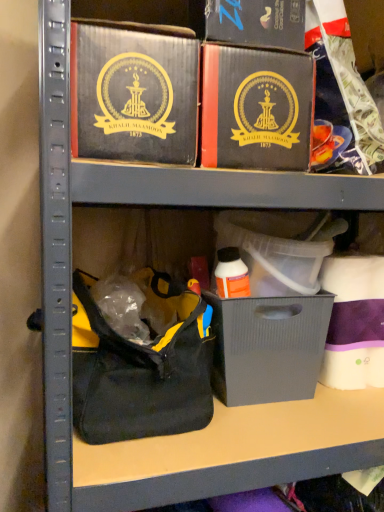
Image resolution: width=384 pixels, height=512 pixels. I want to click on black fabric handbag at lower left, so click(x=141, y=367).

Where is `matte black box at center, marked as the 2th box in a left-to-right arrangement`? matte black box at center, marked as the 2th box in a left-to-right arrangement is located at coordinates (256, 108).

Locate an element on the screen. matte gray plastic bin at center is located at coordinates (268, 347).

You are a GUI agent. You are given a task and a screenshot of the screen. Output one action in this format:
    pyautogui.click(x=<x>, y=<y>)
    Task: Click on the black fabric handbag at lower left
    This screenshot has height=512, width=384.
    Given the screenshot: What is the action you would take?
    pyautogui.click(x=141, y=367)

Is matte black box at upper center positioned with its back to matte black box at upper center, which is counted as the 1th box, starting from the left?

No, matte black box at upper center is not facing away from matte black box at upper center, which is counted as the 1th box, starting from the left.

Considering the sizes of objects matte black box at upper center and matte black box at upper center, the second box in the right-to-left sequence, in the image provided, who is bigger, matte black box at upper center or matte black box at upper center, the second box in the right-to-left sequence,?

matte black box at upper center.

Does point (316, 85) come in front of point (188, 55)?

No.

Measure the distance from matte black box at upper center to matte black box at upper center, which is counted as the 1th box, starting from the left.

7.30 inches.

From the image's perspective, between matte black box at center, marked as the 2th box in a left-to-right arrangement, and black fabric handbag at lower left, who is located below?

black fabric handbag at lower left is shown below in the image.

Is matte black box at center, marked as the 2th box in a left-to-right arrangement, oriented towards black fabric handbag at lower left?

No, matte black box at center, marked as the 2th box in a left-to-right arrangement, is not oriented towards black fabric handbag at lower left.

Between matte black box at center, marked as the 2th box in a left-to-right arrangement, and black fabric handbag at lower left, which one has more height?

With more height is black fabric handbag at lower left.

How many degrees apart are the facing directions of matte black box at center, arranged as the 1th box when viewed from the right, and black fabric handbag at lower left?

0.353 degrees.

Which of these two, matte black box at center, arranged as the 1th box when viewed from the right, or matte black box at upper center, the second box in the right-to-left sequence, stands taller?

matte black box at center, arranged as the 1th box when viewed from the right, is taller.

Based on the photo, is matte black box at center, arranged as the 1th box when viewed from the right, in front of or behind matte black box at upper center, which is counted as the 1th box, starting from the left, in the image?

matte black box at center, arranged as the 1th box when viewed from the right, is behind matte black box at upper center, which is counted as the 1th box, starting from the left.

Is matte black box at center, marked as the 2th box in a left-to-right arrangement, oriented towards matte black box at upper center, which is counted as the 1th box, starting from the left?

No, matte black box at center, marked as the 2th box in a left-to-right arrangement, is not facing towards matte black box at upper center, which is counted as the 1th box, starting from the left.

Is matte black box at center, marked as the 2th box in a left-to-right arrangement, inside the boundaries of matte black box at upper center, or outside?

matte black box at center, marked as the 2th box in a left-to-right arrangement, is located beyond the bounds of matte black box at upper center.

Considering the positions of objects matte black box at center, marked as the 2th box in a left-to-right arrangement, and matte black box at upper center in the image provided, who is more to the left, matte black box at center, marked as the 2th box in a left-to-right arrangement, or matte black box at upper center?

From the viewer's perspective, matte black box at center, marked as the 2th box in a left-to-right arrangement, appears more on the left side.

Is matte black box at center, marked as the 2th box in a left-to-right arrangement, positioned far away from matte black box at upper center?

They are positioned close to each other.

Looking at their sizes, would you say matte black box at center, arranged as the 1th box when viewed from the right, is wider or thinner than matte black box at upper center?

Considering their sizes, matte black box at center, arranged as the 1th box when viewed from the right, looks broader than matte black box at upper center.

Consider the image. From the image's perspective, is matte black box at upper center on black fabric handbag at lower left?

Yes, from the image's perspective, matte black box at upper center is above black fabric handbag at lower left.

Is black fabric handbag at lower left a part of matte black box at upper center?

No, black fabric handbag at lower left is not surrounded by matte black box at upper center.

At what (x,y) coordinates should I click in order to perform the action: click on collection behind the black fabric handbag at lower left. Please return your answer as a coordinate pair (x, y). Looking at the image, I should click on (342, 87).

From the image's perspective, which is below, black fabric handbag at lower left or matte gray plastic bin at center?

matte gray plastic bin at center.

Choose the correct answer: Is black fabric handbag at lower left inside matte gray plastic bin at center or outside it?

black fabric handbag at lower left exists outside the volume of matte gray plastic bin at center.

Image resolution: width=384 pixels, height=512 pixels. Find the location of `handbag on the left of matte gray plastic bin at center`. handbag on the left of matte gray plastic bin at center is located at coordinates (141, 367).

Considering the sizes of black fabric handbag at lower left and matte gray plastic bin at center in the image, is black fabric handbag at lower left wider or thinner than matte gray plastic bin at center?

Considering their sizes, black fabric handbag at lower left looks broader than matte gray plastic bin at center.

Who is more distant, matte gray plastic bin at center or matte black box at upper center?

matte gray plastic bin at center is more distant.

Is matte gray plastic bin at center positioned with its back to matte black box at upper center?

matte gray plastic bin at center is not turned away from matte black box at upper center.

Looking at this image, between matte gray plastic bin at center and matte black box at upper center, which one appears on the right side from the viewer's perspective?

matte black box at upper center is more to the right.

Considering the relative sizes of matte gray plastic bin at center and matte black box at upper center in the image provided, is matte gray plastic bin at center taller than matte black box at upper center?

No, matte gray plastic bin at center is not taller than matte black box at upper center.

The image size is (384, 512). What are the coordinates of `box that is the 2nd one when counting leftward from the matte black box at upper center` in the screenshot? It's located at tap(134, 92).

I want to click on handbag located below the matte black box at center, arranged as the 1th box when viewed from the right (from the image's perspective), so click(141, 367).

Considering their positions, is matte black box at upper center, the second box in the right-to-left sequence, positioned closer to black fabric handbag at lower left than matte gray plastic bin at center?

The object closer to black fabric handbag at lower left is matte gray plastic bin at center.

Which object lies nearer to the anchor point matte black box at center, marked as the 2th box in a left-to-right arrangement, matte gray plastic bin at center or matte black box at upper center?

matte black box at upper center is closer to matte black box at center, marked as the 2th box in a left-to-right arrangement.

From the picture: Estimate the real-world distances between objects in this image. Which object is closer to matte gray plastic bin at center, matte black box at center, arranged as the 1th box when viewed from the right, or matte black box at upper center, the second box in the right-to-left sequence?

matte black box at center, arranged as the 1th box when viewed from the right, is positioned closer to the anchor matte gray plastic bin at center.

From the image, which object appears to be nearer to matte black box at upper center, matte black box at center, marked as the 2th box in a left-to-right arrangement, or black fabric handbag at lower left?

matte black box at center, marked as the 2th box in a left-to-right arrangement, is positioned closer to the anchor matte black box at upper center.

Considering their positions, is matte black box at upper center positioned further to matte black box at center, arranged as the 1th box when viewed from the right, than black fabric handbag at lower left?

black fabric handbag at lower left lies further to matte black box at center, arranged as the 1th box when viewed from the right, than the other object.

When comparing their distances from matte black box at upper center, which is counted as the 1th box, starting from the left, does matte black box at center, marked as the 2th box in a left-to-right arrangement, or matte gray plastic bin at center seem further?

matte gray plastic bin at center is further to matte black box at upper center, which is counted as the 1th box, starting from the left.

Estimate the real-world distances between objects in this image. Which object is further from matte black box at upper center, matte gray plastic bin at center or matte black box at center, marked as the 2th box in a left-to-right arrangement?

matte gray plastic bin at center.

From the image, which object appears to be farther from matte black box at center, marked as the 2th box in a left-to-right arrangement, black fabric handbag at lower left or matte black box at upper center, the second box in the right-to-left sequence?

black fabric handbag at lower left.

Find the location of a particular element. Image resolution: width=384 pixels, height=512 pixels. handbag between matte black box at upper center, which is counted as the 1th box, starting from the left, and matte gray plastic bin at center vertically is located at coordinates (141, 367).

Where is `handbag that lies between matte black box at upper center and matte gray plastic bin at center from top to bottom`? The width and height of the screenshot is (384, 512). handbag that lies between matte black box at upper center and matte gray plastic bin at center from top to bottom is located at coordinates (141, 367).

Where is `handbag between matte black box at center, marked as the 2th box in a left-to-right arrangement, and matte gray plastic bin at center, in the vertical direction`? The image size is (384, 512). handbag between matte black box at center, marked as the 2th box in a left-to-right arrangement, and matte gray plastic bin at center, in the vertical direction is located at coordinates (141, 367).

You are a GUI agent. You are given a task and a screenshot of the screen. Output one action in this format:
    pyautogui.click(x=<x>, y=<y>)
    Task: Click on the box between matte black box at upper center, the second box in the right-to-left sequence, and matte gray plastic bin at center, in the vertical direction
    
    Given the screenshot: What is the action you would take?
    pyautogui.click(x=256, y=108)